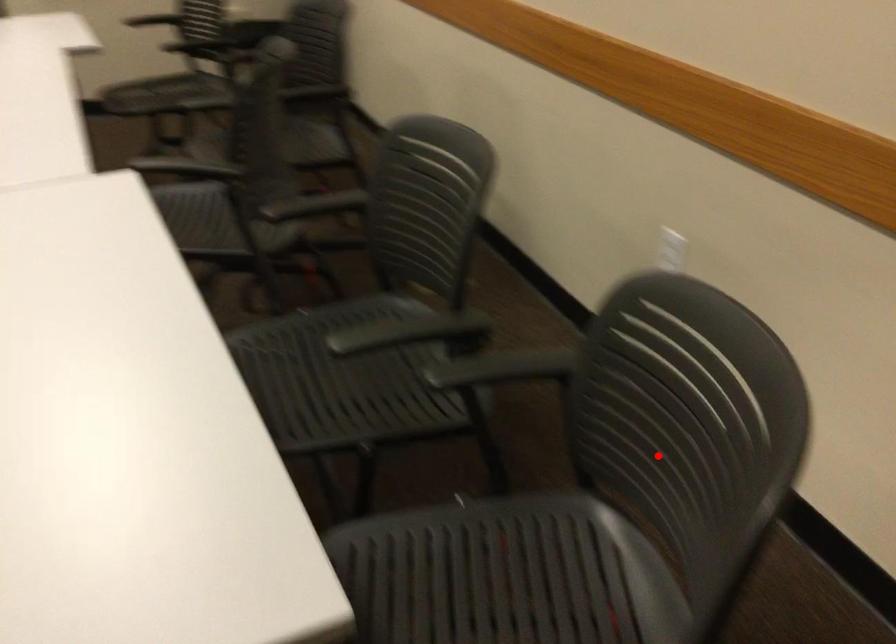
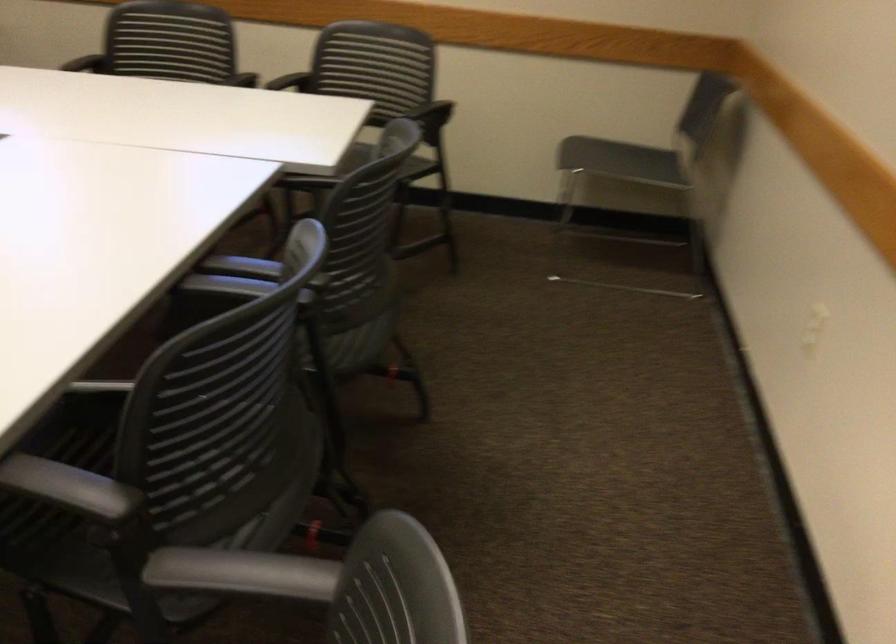
Question: A red point is marked in image1. In image2, is the corresponding 3D point closer to the camera or farther? Reply with the corresponding letter.

Choices:
 (A) The corresponding 3D point is closer.
 (B) The corresponding 3D point is farther.

Answer: (B)